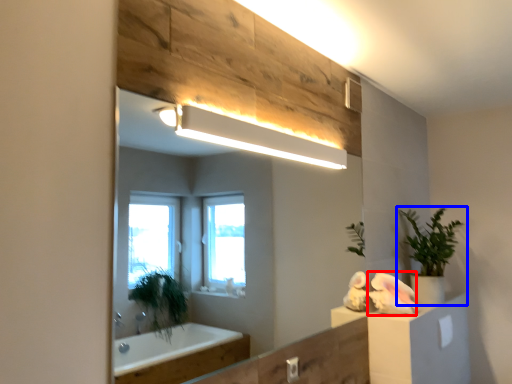
Question: Which object appears closest to the camera in this image, animal (highlighted by a red box) or houseplant (highlighted by a blue box)?

Choices:
 (A) animal
 (B) houseplant

Answer: (A)